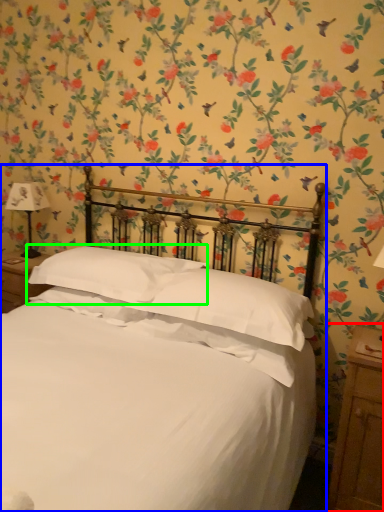
Question: Which object is the farthest from nightstand (highlighted by a red box)? Choose among these: bed (highlighted by a blue box) or pillow (highlighted by a green box).

Choices:
 (A) bed
 (B) pillow

Answer: (B)